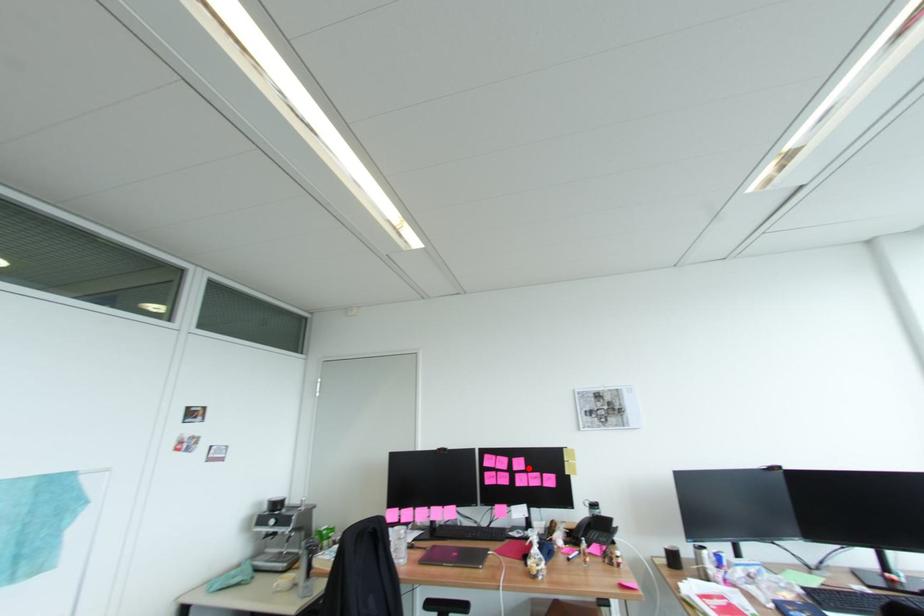
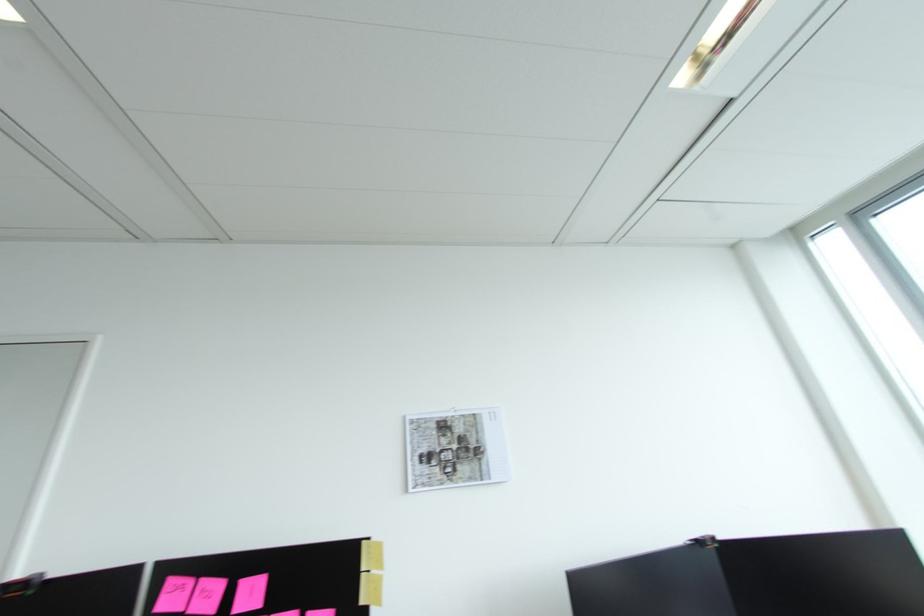
In the second image, find the point that corresponds to the highlighted location in the first image.

(262, 605)